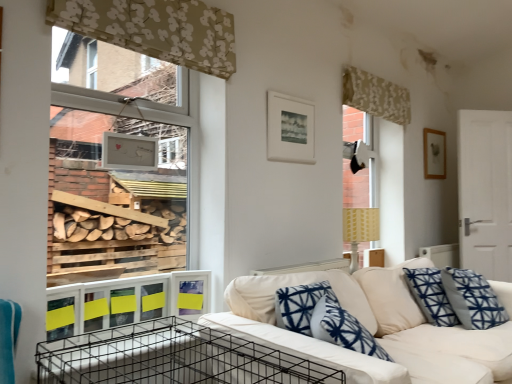
Question: Does white matte picture frame at upper center, placed as the first picture frame when sorted from front to back, have a lesser height compared to wooden picture frame at upper right, the second picture frame viewed from the left?

Choices:
 (A) yes
 (B) no

Answer: (A)

Question: Considering the relative sizes of white matte picture frame at upper center, which ranks as the first picture frame in left-to-right order, and wooden picture frame at upper right, the second picture frame viewed from the left, in the image provided, is white matte picture frame at upper center, which ranks as the first picture frame in left-to-right order, taller than wooden picture frame at upper right, the second picture frame viewed from the left,?

Choices:
 (A) no
 (B) yes

Answer: (A)

Question: Can you confirm if white matte picture frame at upper center, which ranks as the first picture frame in left-to-right order, is smaller than wooden picture frame at upper right, the 2th picture frame from the front?

Choices:
 (A) no
 (B) yes

Answer: (B)

Question: From a real-world perspective, is white matte picture frame at upper center, marked as the second picture frame in a right-to-left arrangement, below wooden picture frame at upper right, the 1th picture frame from the back?

Choices:
 (A) yes
 (B) no

Answer: (A)

Question: Does white matte picture frame at upper center, marked as the second picture frame in a right-to-left arrangement, appear on the left side of wooden picture frame at upper right, the second picture frame viewed from the left?

Choices:
 (A) no
 (B) yes

Answer: (B)

Question: Is white fabric couch at center taller or shorter than white matte picture frame at upper center, marked as the second picture frame in a right-to-left arrangement?

Choices:
 (A) tall
 (B) short

Answer: (A)

Question: From the image's perspective, relative to white matte picture frame at upper center, marked as the second picture frame in a right-to-left arrangement, is white fabric couch at center above or below?

Choices:
 (A) below
 (B) above

Answer: (A)

Question: Would you say white fabric couch at center is inside or outside white matte picture frame at upper center, which ranks as the first picture frame in left-to-right order?

Choices:
 (A) outside
 (B) inside

Answer: (A)

Question: From a real-world perspective, is white fabric couch at center positioned above or below white matte picture frame at upper center, placed as the first picture frame when sorted from front to back?

Choices:
 (A) below
 (B) above

Answer: (A)

Question: Does point (187, 312) appear closer or farther from the camera than point (275, 97)?

Choices:
 (A) farther
 (B) closer

Answer: (B)

Question: From the image's perspective, is yellow paper at lower left positioned above or below white matte picture frame at upper center, placed as the first picture frame when sorted from front to back?

Choices:
 (A) above
 (B) below

Answer: (B)

Question: Considering the positions of yellow paper at lower left and white matte picture frame at upper center, placed as the first picture frame when sorted from front to back, in the image, is yellow paper at lower left taller or shorter than white matte picture frame at upper center, placed as the first picture frame when sorted from front to back,?

Choices:
 (A) tall
 (B) short

Answer: (B)

Question: Which is correct: yellow paper at lower left is inside white matte picture frame at upper center, which is the second picture frame in back-to-front order, or outside of it?

Choices:
 (A) inside
 (B) outside

Answer: (B)

Question: Looking at their shapes, would you say wooden picture frame at upper right, the 1th picture frame from the back, is wider or thinner than patterned fabric curtain at upper right, which appears as the first curtain when viewed from the right?

Choices:
 (A) wide
 (B) thin

Answer: (B)

Question: From their relative heights in the image, would you say wooden picture frame at upper right, which appears as the 1th picture frame when viewed from the right, is taller or shorter than patterned fabric curtain at upper right, which is counted as the second curtain, starting from the left?

Choices:
 (A) short
 (B) tall

Answer: (B)